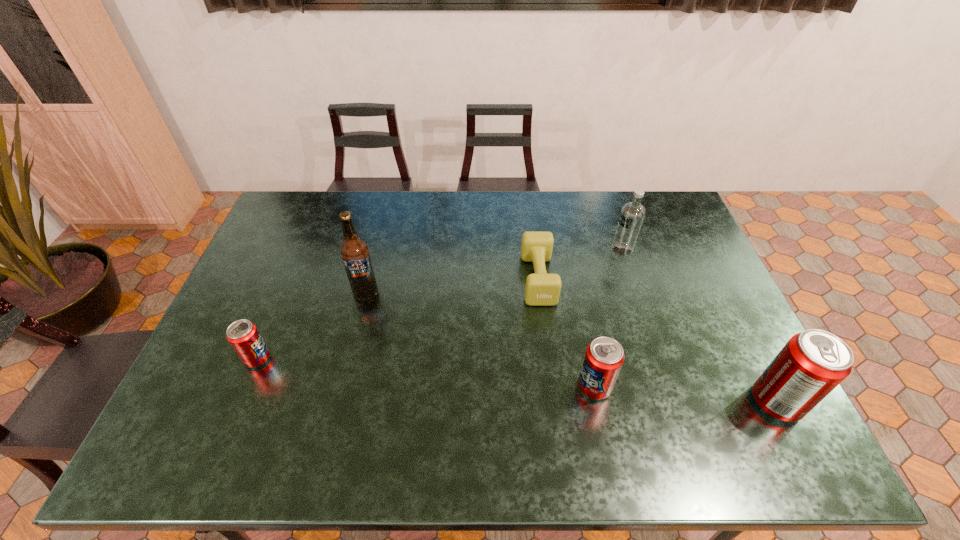
What are the coordinates of `unoccupied area between the second soda can from left to right and the fifth tallest object` in the screenshot? It's located at (426, 373).

At what (x,y) coordinates should I click in order to perform the action: click on vacant area between the fourth object from left to right and the fourth object from right to left. Please return your answer as a coordinate pair (x, y). This screenshot has width=960, height=540. Looking at the image, I should click on (566, 333).

Where is `vacant space that is in between the third object from left to right and the shortest soda can`? This screenshot has width=960, height=540. vacant space that is in between the third object from left to right and the shortest soda can is located at coordinates 397,319.

Identify the location of free spot between the vodka and the second soda can from right to left. (608, 318).

The height and width of the screenshot is (540, 960). Find the location of `vacant point located between the shortest object and the rightmost soda can`. vacant point located between the shortest object and the rightmost soda can is located at coordinates (657, 340).

The height and width of the screenshot is (540, 960). Identify the location of vacant area between the second object from right to left and the leftmost object. (440, 304).

This screenshot has height=540, width=960. Find the location of `vacant area that lies between the second object from right to left and the dumbbell`. vacant area that lies between the second object from right to left and the dumbbell is located at coordinates (580, 264).

The image size is (960, 540). In order to click on vacant region between the second object from right to left and the third shortest object in this screenshot , I will do `click(608, 318)`.

This screenshot has width=960, height=540. I want to click on unoccupied position between the third shortest object and the fourth farthest object, so [x=426, y=373].

Image resolution: width=960 pixels, height=540 pixels. I want to click on the fourth closest object to the fifth object from left to right, so click(354, 251).